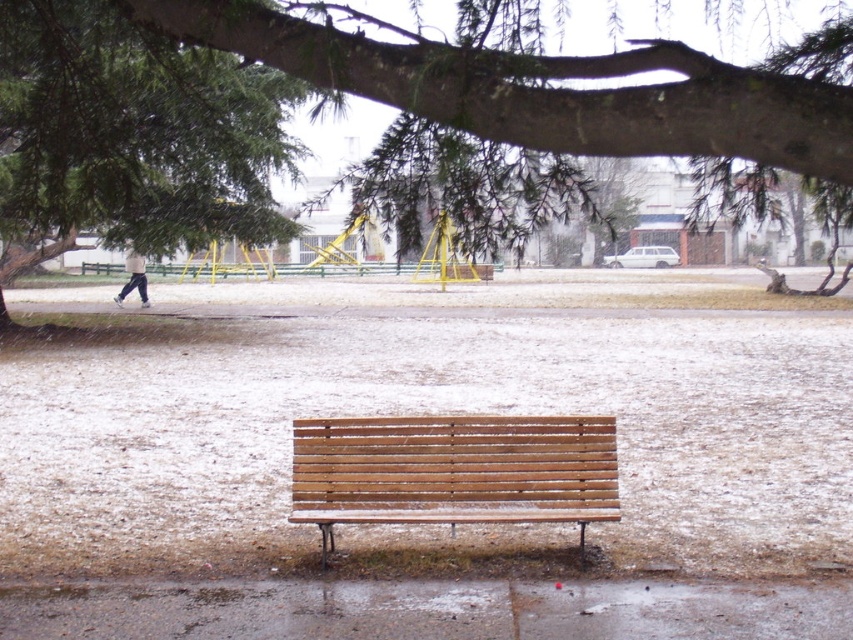
You are standing at the wooden bench in the winter scene. You see a green textured branch at upper center and white cotton pants at left. Which object is taller?

The green textured branch at upper center is much taller than the white cotton pants at left.

You are standing at the edge of the park and see the green textured branch at upper center and the white cotton pants at left. Which object is larger in size?

The green textured branch at upper center is bigger than the white cotton pants at left.

You are a park maintenance worker who needs to place a new bench that is 1.5 meters wide. You see the light brown wooden bench at center and the white cotton pants at left. Can the new bench fit in the space between them?

The light brown wooden bench at center is narrower than the white cotton pants at left. Since the new bench is 1.5 meters wide, you need to check the distance between them. However, the description only provides their widths, not the distance between them. Therefore, it is impossible to determine if the new bench will fit based on the given information.